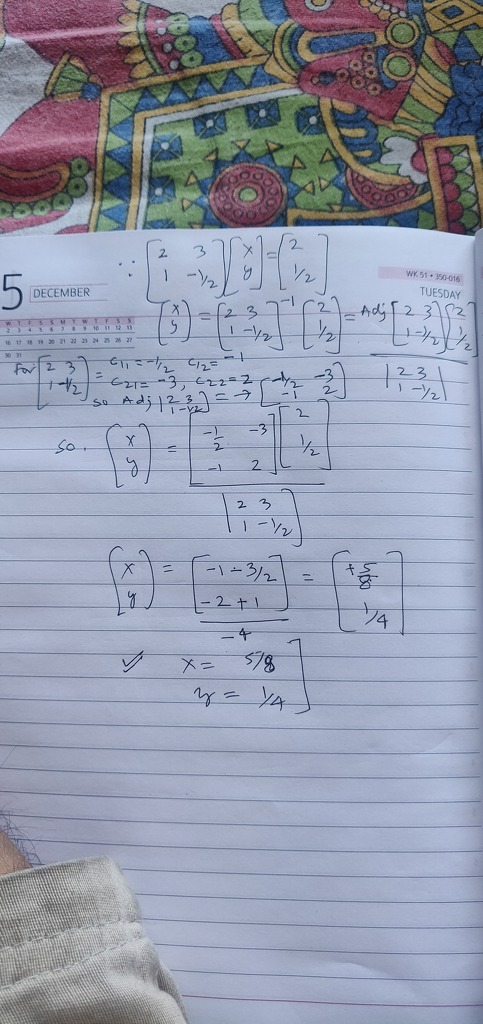
Find the location of a particular element. The image size is (483, 1024). calendar is located at coordinates (65, 331).